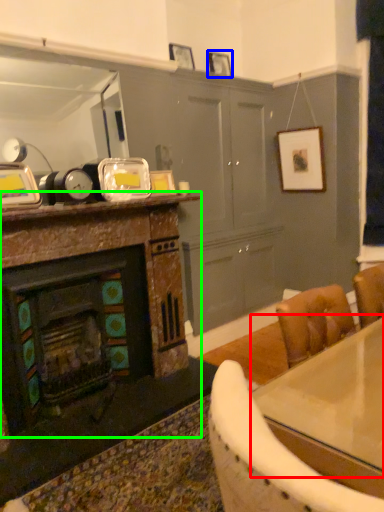
Question: Which object is positioned farthest from counter top (highlighted by a red box)? Select from picture frame (highlighted by a blue box) and cabinetry (highlighted by a green box).

Choices:
 (A) picture frame
 (B) cabinetry

Answer: (A)